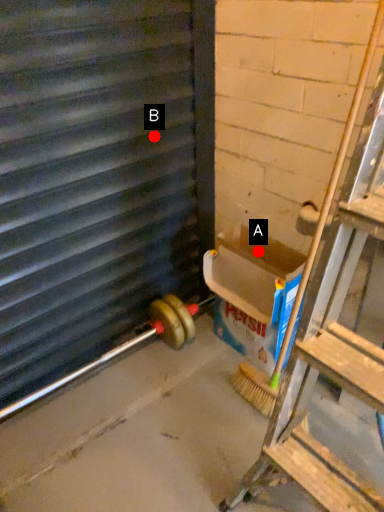
Question: Two points are circled on the image, labeled by A and B beside each circle. Which of the following is the farthest from the observer?

Choices:
 (A) A is further
 (B) B is further

Answer: (A)